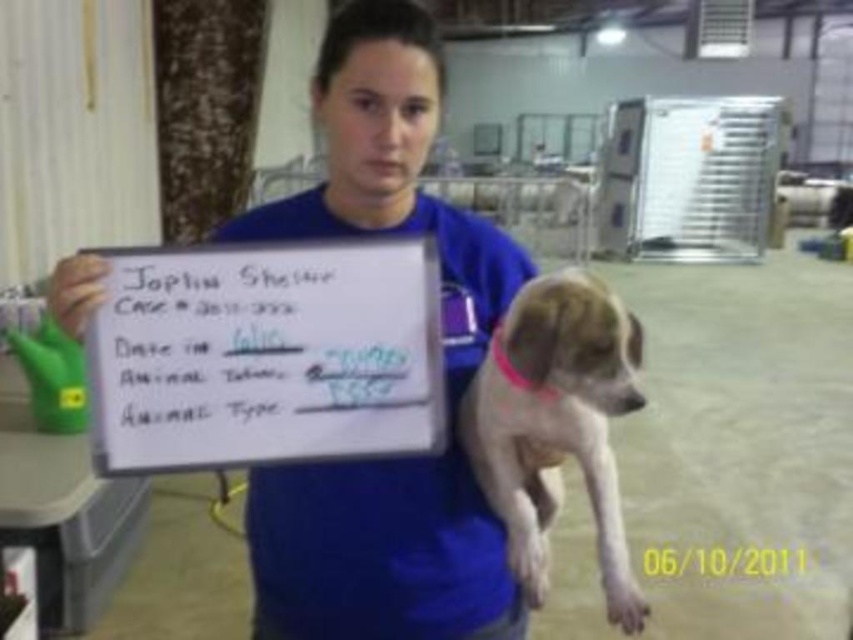
You are standing in front of the metal shelving units and want to determine which of the two points, point (329, 81) or point (573, 452), is nearer to you. Based on the image, which point is closer?

Point (329, 81) is closer to the viewer than point (573, 452).